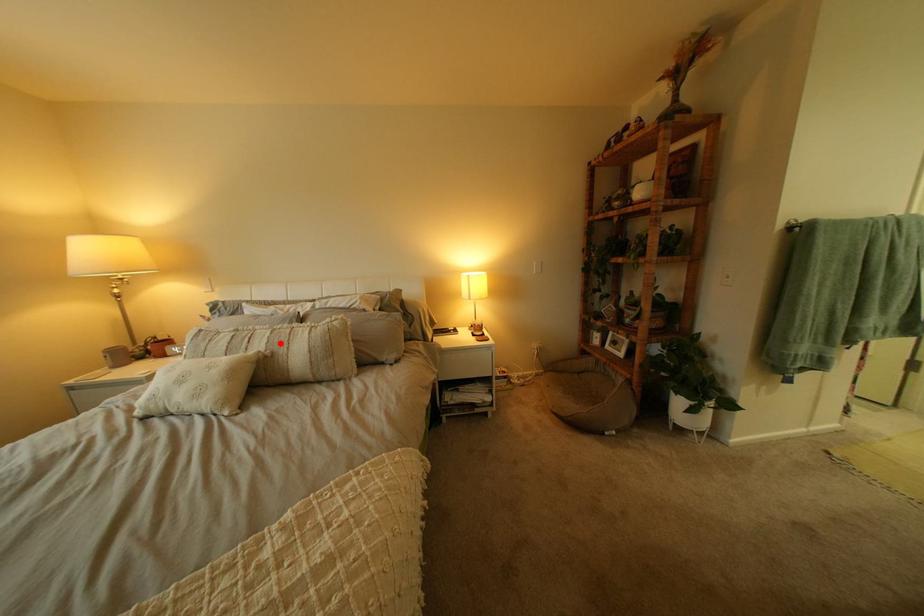
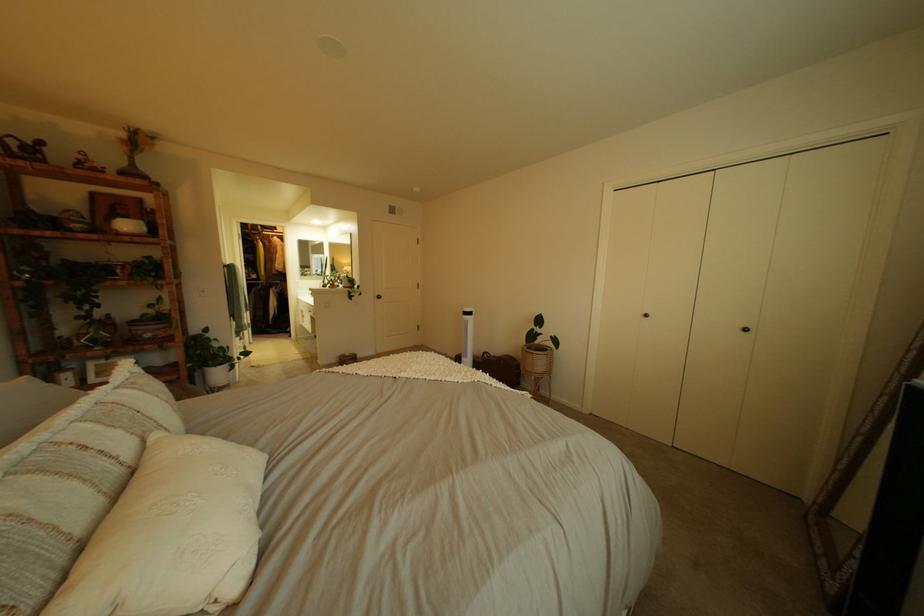
Where in the second image is the point corresponding to the highlighted location from the first image?

(134, 434)